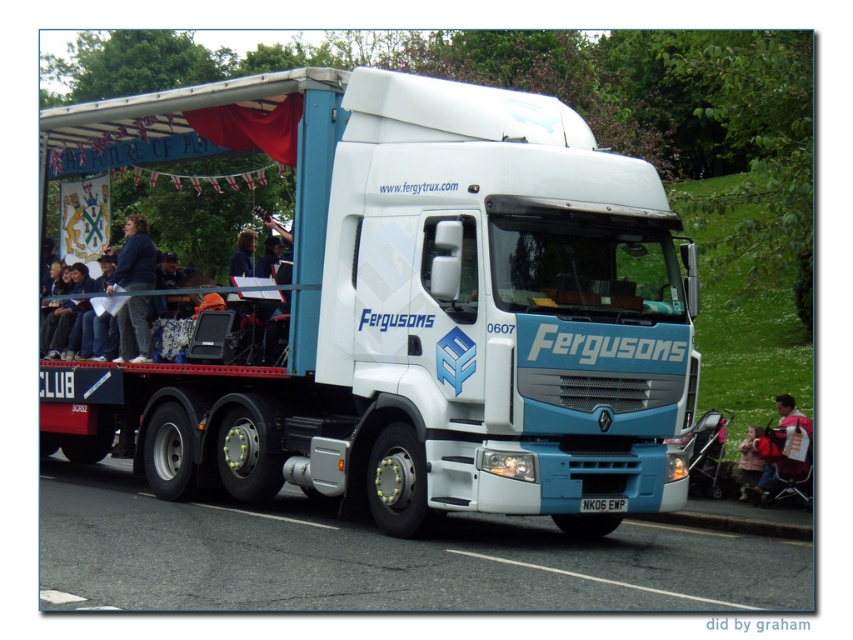
Which is above, white glossy truck at center or white plastic license plate at center?

Positioned higher is white glossy truck at center.

Does white glossy truck at center have a larger size compared to white plastic license plate at center?

Correct, white glossy truck at center is larger in size than white plastic license plate at center.

Find the location of a particular element. This screenshot has height=640, width=853. white glossy truck at center is located at coordinates (422, 316).

Where is `white glossy truck at center`? This screenshot has width=853, height=640. white glossy truck at center is located at coordinates (422, 316).

Does light pink fabric at lower right have a lesser width compared to white plastic license plate at center?

Incorrect, light pink fabric at lower right's width is not less than white plastic license plate at center's.

Can you confirm if light pink fabric at lower right is positioned below white plastic license plate at center?

No, light pink fabric at lower right is not below white plastic license plate at center.

Between point (784, 461) and point (618, 512), which one is positioned in front?

Point (618, 512) is in front.

You are a GUI agent. You are given a task and a screenshot of the screen. Output one action in this format:
    pyautogui.click(x=<x>, y=<y>)
    Task: Click on the light pink fabric at lower right
    The height and width of the screenshot is (640, 853).
    Given the screenshot: What is the action you would take?
    782,449

Is white glossy truck at center bigger than dark blue fabric at left?

No, white glossy truck at center is not bigger than dark blue fabric at left.

Does white glossy truck at center have a smaller size compared to dark blue fabric at left?

Yes, white glossy truck at center is smaller than dark blue fabric at left.

Between point (477, 460) and point (137, 326), which one is positioned behind?

The point (137, 326) is behind.

Image resolution: width=853 pixels, height=640 pixels. In order to click on white glossy truck at center in this screenshot , I will do `click(422, 316)`.